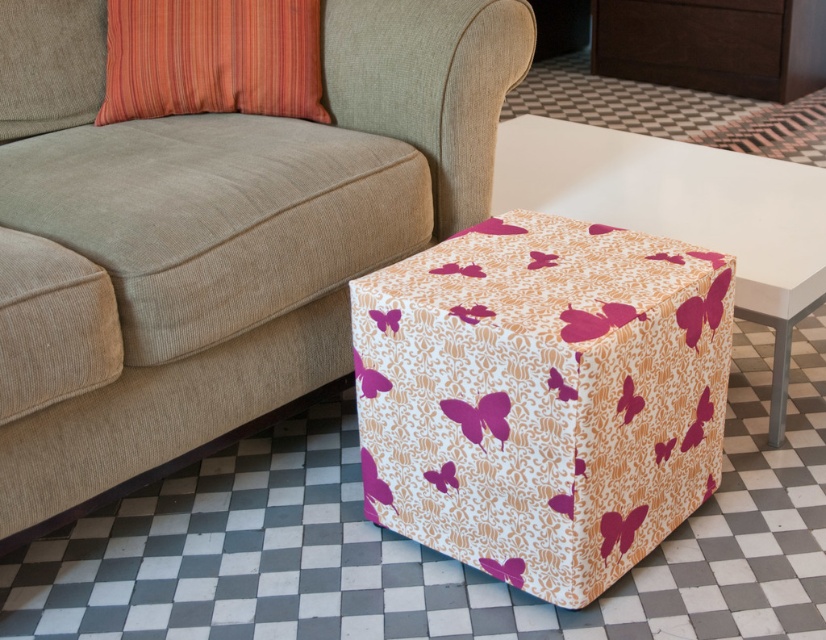
You are arranging a living room and need to place a new plant stand between the white fabric with pink butterflies at lower right and the orange striped pillow at upper left. Based on their positions, which side of the plant stand should face the sofa?

The plant stand should face the sofa towards the orange striped pillow at upper left because the white fabric with pink butterflies at lower right is positioned to the right of the orange striped pillow at upper left.

You are sitting on the beige sofa and want to place a book on the nearest fabric item. Which fabric item should you choose between the white fabric with pink butterflies at lower right and the matte pink fabric cube at center?

The white fabric with pink butterflies at lower right is closer to the viewer than the matte pink fabric cube at center, so you should choose the white fabric with pink butterflies at lower right as it is nearer.

You are standing at the point marked as point (515, 144) and want to reach the sofa. The sofa is 1.8 meters wide. Can you walk straight to the sofa without deviating from your path?

The distance between point (515, 144) and the sofa is 2.23 meters, and the sofa is 1.8 meters wide. Since the sofa is wider than the distance, you can walk straight to the sofa without deviating from your path.